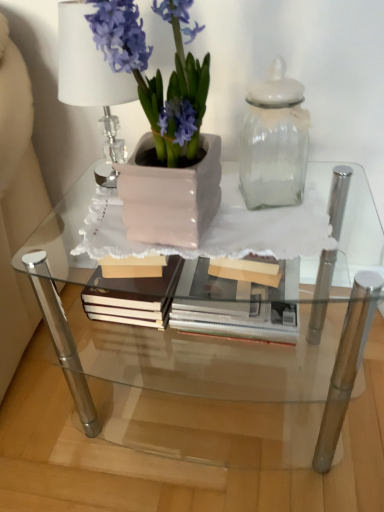
Locate an element on the screen. The width and height of the screenshot is (384, 512). matte pink pot at left is located at coordinates (158, 77).

What do you see at coordinates (274, 141) in the screenshot? This screenshot has width=384, height=512. I see `transparent glass jar at upper right` at bounding box center [274, 141].

At what (x,y) coordinates should I click in order to perform the action: click on clear glass table at center. Please return your answer as a coordinate pair (x, y). Looking at the image, I should click on (204, 384).

Is transparent glass jar at upper right to the left of clear glass table at center from the viewer's perspective?

No, transparent glass jar at upper right is not to the left of clear glass table at center.

You are a GUI agent. You are given a task and a screenshot of the screen. Output one action in this format:
    pyautogui.click(x=<x>, y=<y>)
    Task: Click on the table located on the left of transparent glass jar at upper right
    The image size is (384, 512).
    Given the screenshot: What is the action you would take?
    coord(204,384)

Could you tell me if transparent glass jar at upper right is facing clear glass table at center?

No, transparent glass jar at upper right is not facing towards clear glass table at center.

Can you confirm if clear crystal table lamp at upper left is wider than clear glass table at center?

In fact, clear crystal table lamp at upper left might be narrower than clear glass table at center.

Are clear crystal table lamp at upper left and clear glass table at center far apart?

No.

Based on their sizes in the image, would you say clear crystal table lamp at upper left is bigger or smaller than clear glass table at center?

Considering their sizes, clear crystal table lamp at upper left takes up less space than clear glass table at center.

Considering the relative sizes of clear crystal table lamp at upper left and clear glass table at center in the image provided, is clear crystal table lamp at upper left taller than clear glass table at center?

→ Incorrect, the height of clear crystal table lamp at upper left is not larger of that of clear glass table at center.

You are a GUI agent. You are given a task and a screenshot of the screen. Output one action in this format:
    pyautogui.click(x=<x>, y=<y>)
    Task: Click on the table that is behind the matte pink pot at left
    The height and width of the screenshot is (512, 384).
    Given the screenshot: What is the action you would take?
    pyautogui.click(x=204, y=384)

Is clear glass table at center beside matte pink pot at left?

clear glass table at center is not next to matte pink pot at left, and they're not touching.

Can you confirm if clear glass table at center is taller than matte pink pot at left?

Correct, clear glass table at center is much taller as matte pink pot at left.

Looking at this image, from the image's perspective, relative to matte pink pot at left, is clear glass table at center above or below?

Based on their image positions, clear glass table at center is located beneath matte pink pot at left.

Which is in front, matte pink pot at left or clear crystal table lamp at upper left?

matte pink pot at left is in front.

Does point (142, 67) lie behind point (90, 32)?

No, (142, 67) is in front of (90, 32).

Is clear crystal table lamp at upper left completely or partially inside matte pink pot at left?

No, matte pink pot at left does not contain clear crystal table lamp at upper left.

Is matte pink pot at left wider than clear crystal table lamp at upper left?

Yes, matte pink pot at left is wider than clear crystal table lamp at upper left.

What's the angular difference between clear glass table at center and clear crystal table lamp at upper left's facing directions?

0.782 degrees separate the facing orientations of clear glass table at center and clear crystal table lamp at upper left.

Between clear glass table at center and clear crystal table lamp at upper left, which one has smaller size?

clear crystal table lamp at upper left.

From the image's perspective, is clear glass table at center beneath clear crystal table lamp at upper left?

Yes.

Considering the sizes of objects clear glass table at center and clear crystal table lamp at upper left in the image provided, who is wider, clear glass table at center or clear crystal table lamp at upper left?

Wider between the two is clear glass table at center.

Which of these two, transparent glass jar at upper right or clear crystal table lamp at upper left, stands taller?

clear crystal table lamp at upper left.

Is transparent glass jar at upper right positioned far away from clear crystal table lamp at upper left?

No, transparent glass jar at upper right is not far from clear crystal table lamp at upper left.

Based on their sizes in the image, would you say transparent glass jar at upper right is bigger or smaller than clear crystal table lamp at upper left?

transparent glass jar at upper right is smaller than clear crystal table lamp at upper left.

How far apart are transparent glass jar at upper right and clear crystal table lamp at upper left?

transparent glass jar at upper right is 31.87 centimeters from clear crystal table lamp at upper left.

Looking at this image, measure the distance between clear crystal table lamp at upper left and transparent glass jar at upper right.

clear crystal table lamp at upper left and transparent glass jar at upper right are 12.55 inches apart from each other.

From the image's perspective, between clear crystal table lamp at upper left and transparent glass jar at upper right, which one is located above?

clear crystal table lamp at upper left.

Is clear crystal table lamp at upper left to the left or to the right of transparent glass jar at upper right in the image?

In the image, clear crystal table lamp at upper left appears on the left side of transparent glass jar at upper right.

From a real-world perspective, is clear crystal table lamp at upper left above or below transparent glass jar at upper right?

From a real-world perspective, clear crystal table lamp at upper left is physically above transparent glass jar at upper right.

The image size is (384, 512). I want to click on glass vase lying above the clear glass table at center (from the image's perspective), so click(x=274, y=141).

The image size is (384, 512). I want to click on table lamp above the clear glass table at center (from a real-world perspective), so click(90, 72).

From the picture: Considering their positions, is matte pink pot at left positioned closer to clear glass table at center than clear crystal table lamp at upper left?

Result: matte pink pot at left lies closer to clear glass table at center than the other object.

Looking at this image, from the image, which object appears to be farther from matte pink pot at left, transparent glass jar at upper right or clear crystal table lamp at upper left?

Among the two, transparent glass jar at upper right is located further to matte pink pot at left.

Looking at the image, which one is located closer to matte pink pot at left, clear crystal table lamp at upper left or transparent glass jar at upper right?

clear crystal table lamp at upper left lies closer to matte pink pot at left than the other object.

Estimate the real-world distances between objects in this image. Which object is closer to transparent glass jar at upper right, clear glass table at center or matte pink pot at left?

matte pink pot at left lies closer to transparent glass jar at upper right than the other object.

In the scene shown: Looking at the image, which one is located further to transparent glass jar at upper right, matte pink pot at left or clear crystal table lamp at upper left?

clear crystal table lamp at upper left.

Looking at the image, which one is located closer to clear glass table at center, transparent glass jar at upper right or clear crystal table lamp at upper left?

Among the two, transparent glass jar at upper right is located nearer to clear glass table at center.

Estimate the real-world distances between objects in this image. Which object is further from clear crystal table lamp at upper left, transparent glass jar at upper right or matte pink pot at left?

transparent glass jar at upper right.

Which object lies further to the anchor point matte pink pot at left, clear glass table at center or transparent glass jar at upper right?

clear glass table at center is positioned further to the anchor matte pink pot at left.

Identify the location of glass vase between clear crystal table lamp at upper left and clear glass table at center in the vertical direction. The height and width of the screenshot is (512, 384). (274, 141).

Where is `houseplant situated between clear crystal table lamp at upper left and transparent glass jar at upper right from left to right`? The image size is (384, 512). houseplant situated between clear crystal table lamp at upper left and transparent glass jar at upper right from left to right is located at coordinates (158, 77).

Locate an element on the screen. This screenshot has width=384, height=512. houseplant between clear crystal table lamp at upper left and clear glass table at center from top to bottom is located at coordinates (158, 77).

At what (x,y) coordinates should I click in order to perform the action: click on houseplant between transparent glass jar at upper right and clear glass table at center in the vertical direction. Please return your answer as a coordinate pair (x, y). This screenshot has width=384, height=512. Looking at the image, I should click on (x=158, y=77).